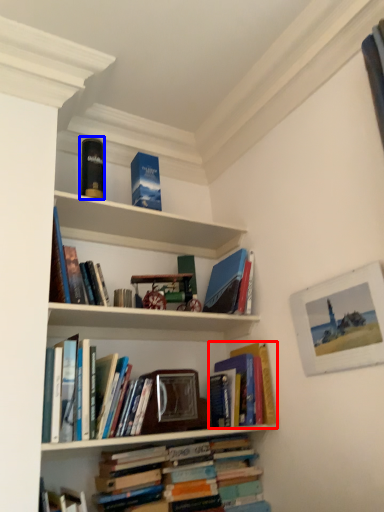
Question: Which object appears farthest to the camera in this image, book (highlighted by a red box) or paperback book (highlighted by a blue box)?

Choices:
 (A) book
 (B) paperback book

Answer: (B)